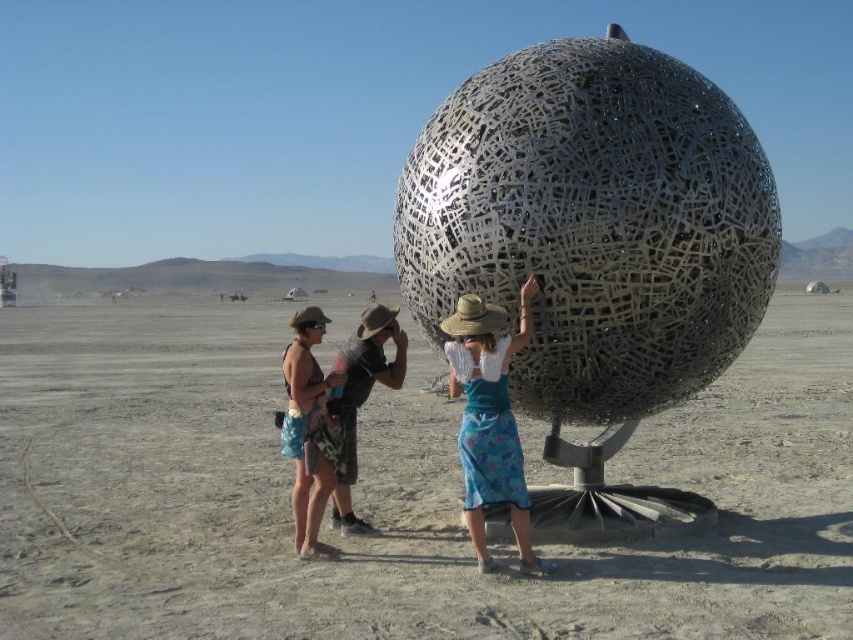
Question: Which of the following is the farthest from the observer?

Choices:
 (A) (387, 372)
 (B) (463, 83)
 (C) (305, 380)

Answer: (B)

Question: Among these objects, which one is nearest to the camera?

Choices:
 (A) metallic sphere at center
 (B) camouflage shorts at center
 (C) blue floral skirt at center
 (D) matte brown shorts at center

Answer: (A)

Question: Which point is farther to the camera?

Choices:
 (A) (517, 433)
 (B) (302, 449)

Answer: (A)

Question: Is the position of metallic mesh sphere at center less distant than that of camouflage shorts at center?

Choices:
 (A) no
 (B) yes

Answer: (B)

Question: Does metallic sphere at center have a larger size compared to metallic mesh sphere at center?

Choices:
 (A) no
 (B) yes

Answer: (B)

Question: Does blue floral skirt at center appear on the right side of matte brown shorts at center?

Choices:
 (A) no
 (B) yes

Answer: (B)